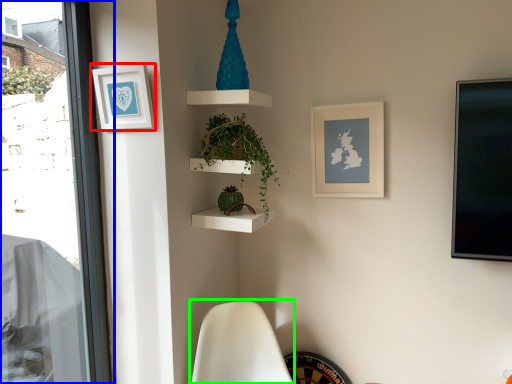
Question: Based on their relative distances, which object is farther from picture frame (highlighted by a red box)? Choose from window (highlighted by a blue box) and swivel chair (highlighted by a green box).

Choices:
 (A) window
 (B) swivel chair

Answer: (B)